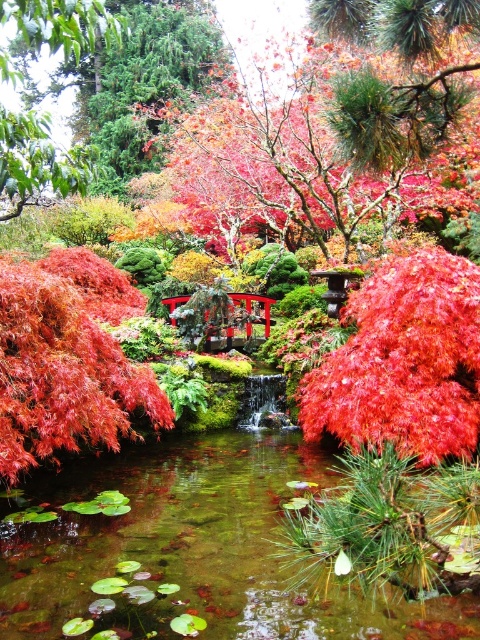
Question: Is vivid red maple leaf at center below shiny red maple at center?

Choices:
 (A) no
 (B) yes

Answer: (B)

Question: Among these objects, which one is nearest to the camera?

Choices:
 (A) shiny red maple at center
 (B) vivid red maple leaf at center

Answer: (A)

Question: Where is vivid red maple leaf at center located in relation to shiny red maple at center in the image?

Choices:
 (A) below
 (B) above

Answer: (A)

Question: Which object is closer to the camera taking this photo?

Choices:
 (A) vivid red maple leaf at center
 (B) shiny red maple at center

Answer: (B)

Question: Is vivid red maple leaf at center further to the viewer compared to shiny red maple at center?

Choices:
 (A) no
 (B) yes

Answer: (B)